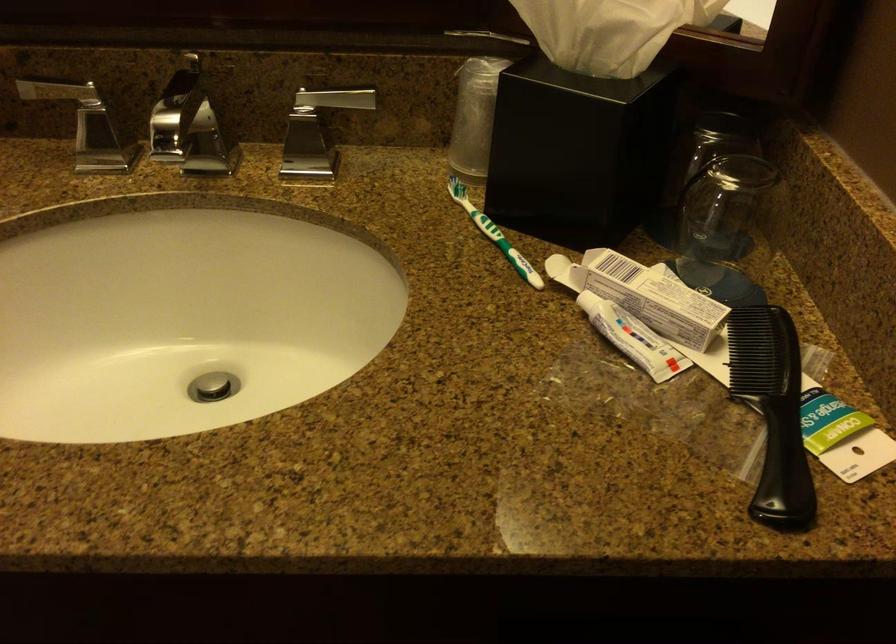
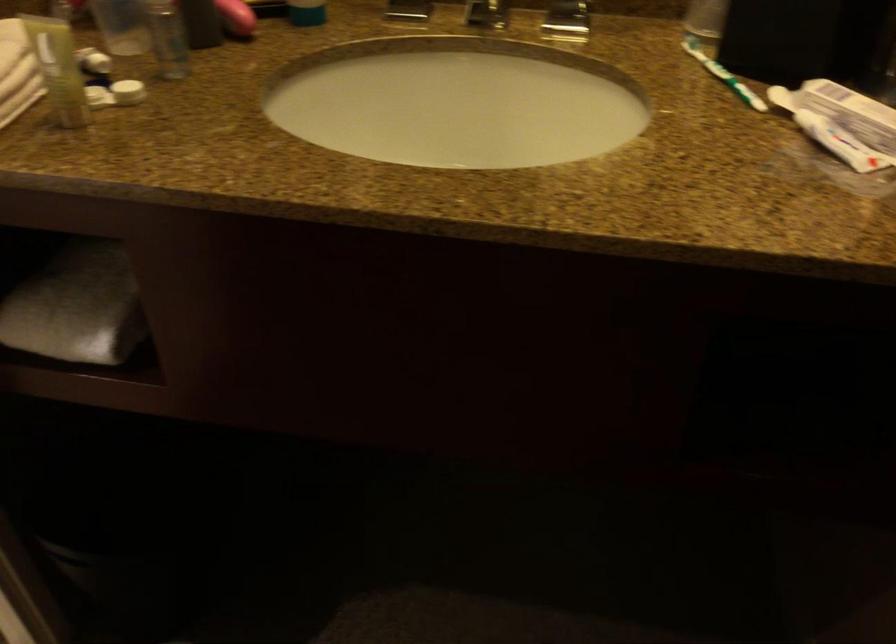
Question: Which direction would the cameraman need to move to produce the second image? Reply with the corresponding letter.

Choices:
 (A) Left
 (B) Right
 (C) Forward
 (D) Backward

Answer: (D)